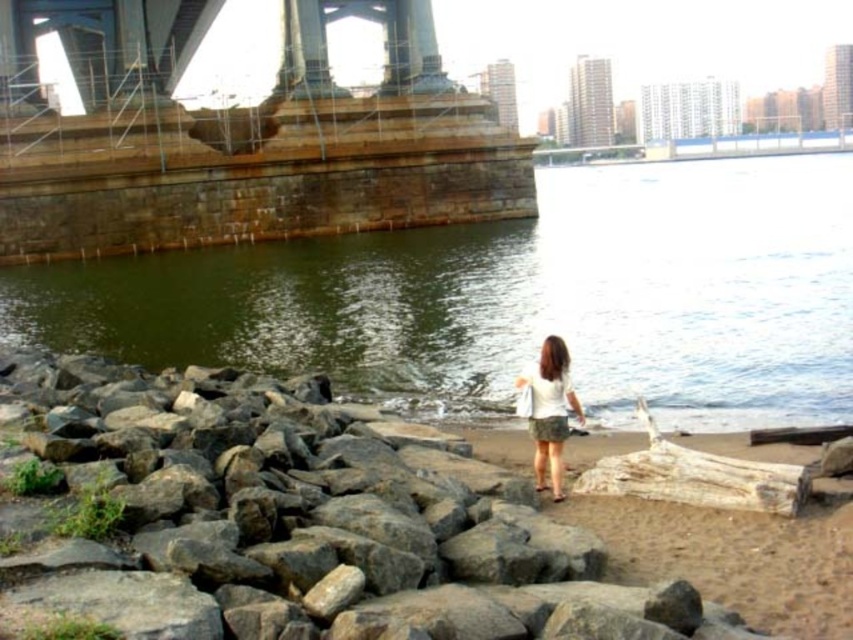
Question: Estimate the real-world distances between objects in this image. Which object is closer to the white fabric skirt at lower right?

Choices:
 (A) gray rock at lower center
 (B) green stone river at center

Answer: (A)

Question: Which of the following is the farthest from the observer?

Choices:
 (A) 816,163
 (B) 546,403
 (C) 200,636

Answer: (A)

Question: Which of the following is the closest to the observer?

Choices:
 (A) (517, 385)
 (B) (596, 356)

Answer: (A)

Question: Does gray rock at lower center have a lesser width compared to white fabric skirt at lower right?

Choices:
 (A) yes
 (B) no

Answer: (B)

Question: Does gray rock at lower center have a larger size compared to white fabric skirt at lower right?

Choices:
 (A) no
 (B) yes

Answer: (B)

Question: Can you confirm if green stone river at center is positioned above gray rock at lower center?

Choices:
 (A) yes
 (B) no

Answer: (A)